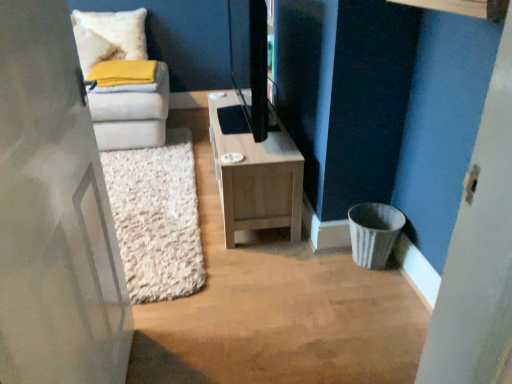
Question: Looking at the image, does light wood/texture tv stand at center seem bigger or smaller compared to white matte door at left?

Choices:
 (A) big
 (B) small

Answer: (A)

Question: In the image, is light wood/texture tv stand at center positioned in front of or behind white matte door at left?

Choices:
 (A) behind
 (B) front

Answer: (A)

Question: Estimate the real-world distances between objects in this image. Which object is farther from the white matte door at left?

Choices:
 (A) white shaggy rug at center
 (B) light wood/texture tv stand at center
 (C) white soft pillow at upper left

Answer: (C)

Question: Which object is the closest to the white soft pillow at upper left?

Choices:
 (A) white shaggy rug at center
 (B) light wood/texture tv stand at center
 (C) white matte door at left

Answer: (A)